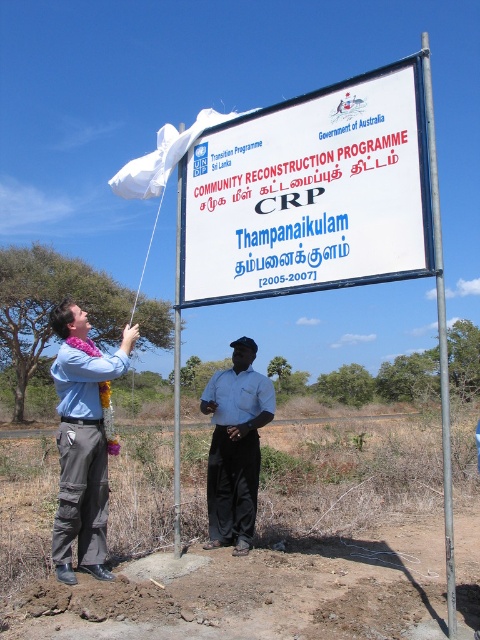
Can you confirm if brown soil at lower center is taller than white plastic sign at upper center?

Yes, brown soil at lower center is taller than white plastic sign at upper center.

Consider the image. Can you confirm if brown soil at lower center is positioned above white plastic sign at upper center?

No, brown soil at lower center is not above white plastic sign at upper center.

At what (x,y) coordinates should I click in order to perform the action: click on brown soil at lower center. Please return your answer as a coordinate pair (x, y). This screenshot has width=480, height=640. Looking at the image, I should click on pos(230,547).

You are a GUI agent. You are given a task and a screenshot of the screen. Output one action in this format:
    pyautogui.click(x=<x>, y=<y>)
    Task: Click on the brown soil at lower center
    This screenshot has width=480, height=640.
    Given the screenshot: What is the action you would take?
    pyautogui.click(x=230, y=547)

Can you confirm if white plastic sign at upper center is positioned to the left of metallic pole at center?

Indeed, white plastic sign at upper center is positioned on the left side of metallic pole at center.

Does point (352, 227) lie behind point (446, 492)?

Yes, it is.

The image size is (480, 640). Identify the location of white plastic sign at upper center. (311, 193).

The image size is (480, 640). In order to click on white shirt at center in this screenshot , I will do `click(236, 445)`.

Is white shirt at center to the left of silver metallic pole at upper center from the viewer's perspective?

No, white shirt at center is not to the left of silver metallic pole at upper center.

At what (x,y) coordinates should I click in order to perform the action: click on white shirt at center. Please return your answer as a coordinate pair (x, y). The width and height of the screenshot is (480, 640). Looking at the image, I should click on tap(236, 445).